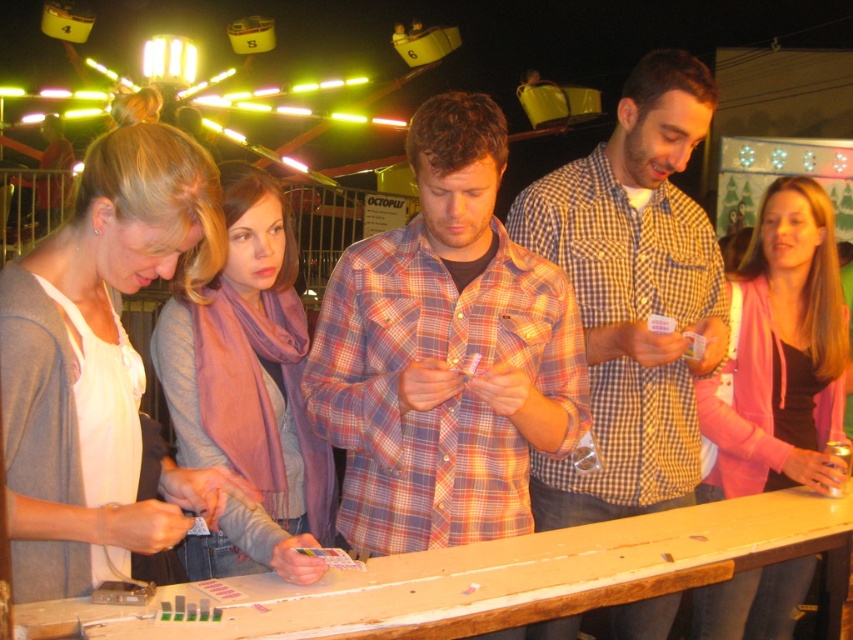
In the scene shown: You are standing at the entrance of the fairground and see the point marked as point (633, 296) in the image. What object or person is located at that point?

The point (633, 296) corresponds to the checkered shirt at center.

You are at the fairground counter and need to place a new ticket on the counter. The ticket is the size of the plaid shirt at center. Will it fit on the remaining space next to the pink fabric jacket at center?

The plaid shirt at center is smaller than the pink fabric jacket at center, so the ticket should fit in the remaining space next to the pink fabric jacket at center since it is smaller.